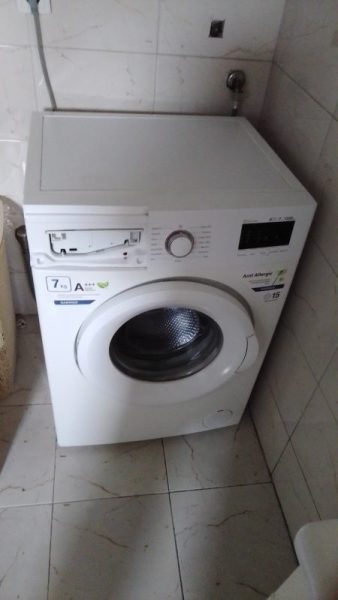
Identify the location of white faceplate. The image size is (338, 600). (48, 7).